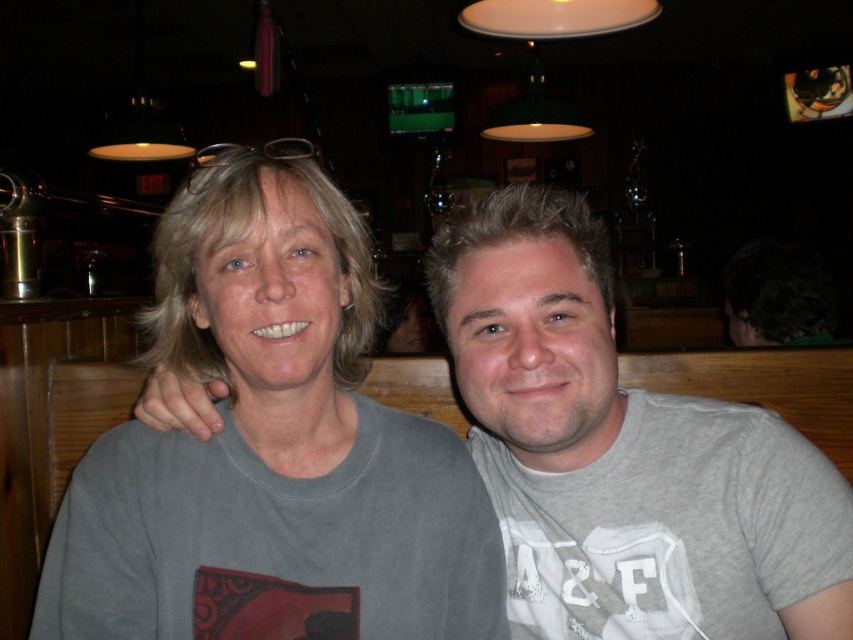
Question: Which of these objects is positioned closest to the gray cotton t-shirt at center?

Choices:
 (A) dark hair at lower right
 (B) gray matte t-shirt at left

Answer: (B)

Question: Does gray matte t-shirt at left have a greater width compared to gray cotton t-shirt at center?

Choices:
 (A) no
 (B) yes

Answer: (B)

Question: Which object is the closest to the dark hair at lower right?

Choices:
 (A) gray matte t-shirt at left
 (B) gray cotton t-shirt at center

Answer: (B)

Question: Which of the following is the farthest from the observer?

Choices:
 (A) (593, 545)
 (B) (807, 336)
 (C) (189, 516)

Answer: (B)

Question: Is gray matte t-shirt at left below gray cotton t-shirt at center?

Choices:
 (A) yes
 (B) no

Answer: (B)

Question: Is gray matte t-shirt at left positioned behind gray cotton t-shirt at center?

Choices:
 (A) yes
 (B) no

Answer: (B)